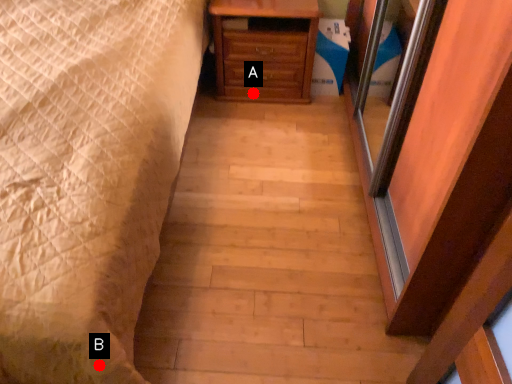
Question: Two points are circled on the image, labeled by A and B beside each circle. Which point is further to the camera?

Choices:
 (A) A is further
 (B) B is further

Answer: (A)